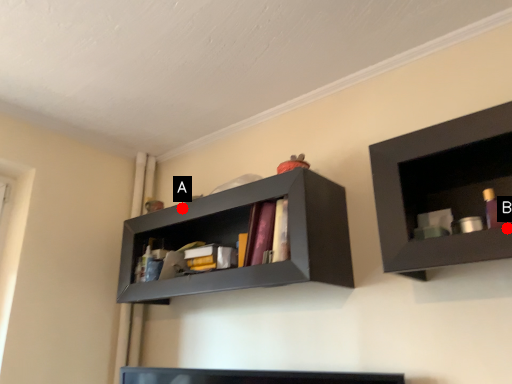
Question: Two points are circled on the image, labeled by A and B beside each circle. Among these points, which one is farthest from the camera?

Choices:
 (A) A is further
 (B) B is further

Answer: (A)